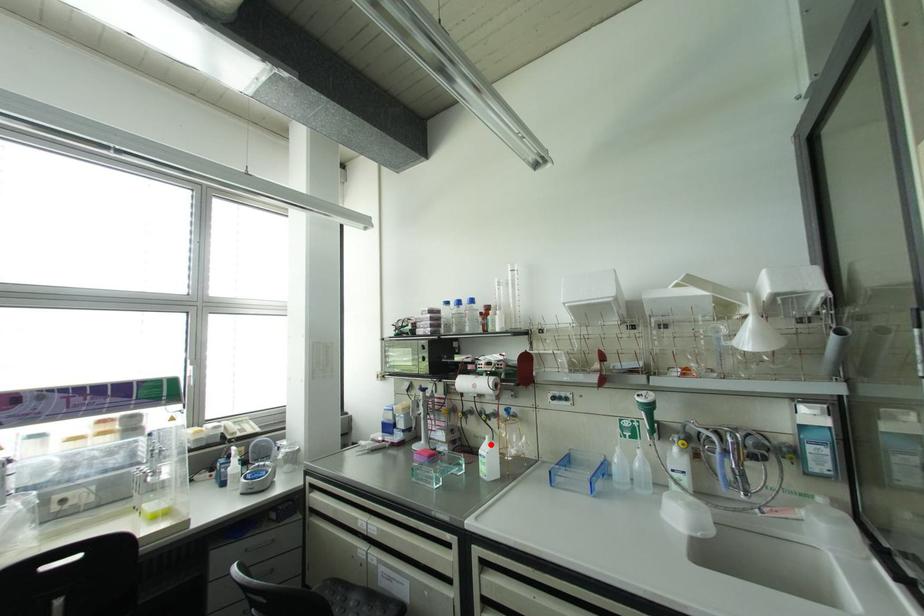
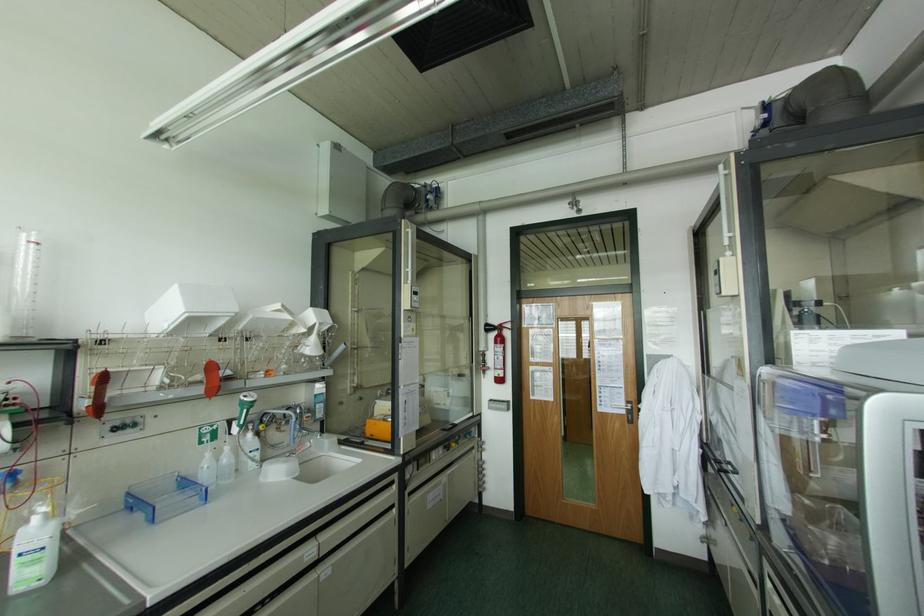
Where in the second image is the point corresponding to the highlighted location from the first image?

(53, 523)